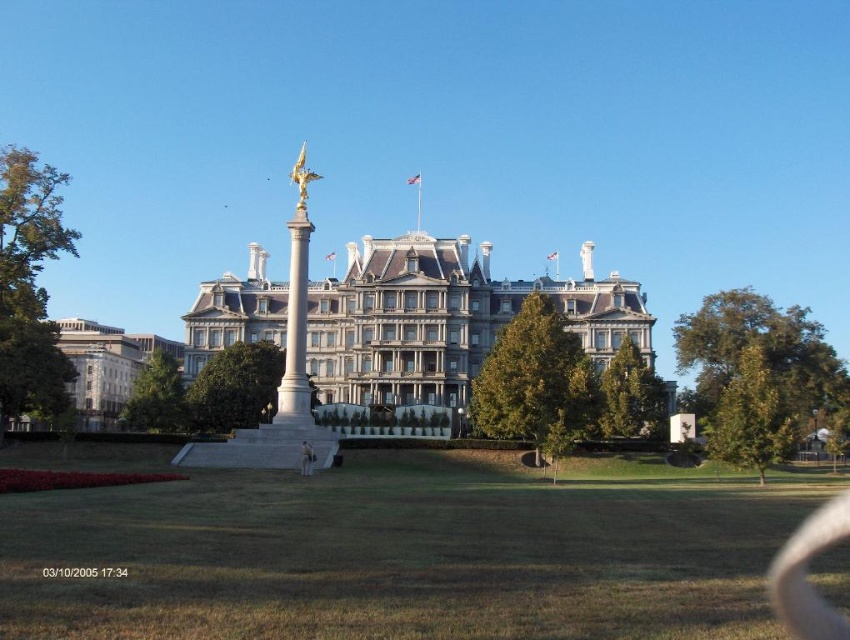
Question: Does green grass at center have a smaller size compared to white marble column at center?

Choices:
 (A) yes
 (B) no

Answer: (B)

Question: Which object is the farthest from the white marble column at center?

Choices:
 (A) green grass at center
 (B) white stone palace at center

Answer: (A)

Question: Among these points, which one is farthest from the camera?

Choices:
 (A) 650,368
 (B) 717,545

Answer: (A)

Question: Does white stone palace at center have a greater width compared to white marble column at center?

Choices:
 (A) yes
 (B) no

Answer: (A)

Question: Is green grass at center bigger than white stone palace at center?

Choices:
 (A) yes
 (B) no

Answer: (B)

Question: Which of these objects is positioned closest to the white stone palace at center?

Choices:
 (A) white marble column at center
 (B) green grass at center

Answer: (A)